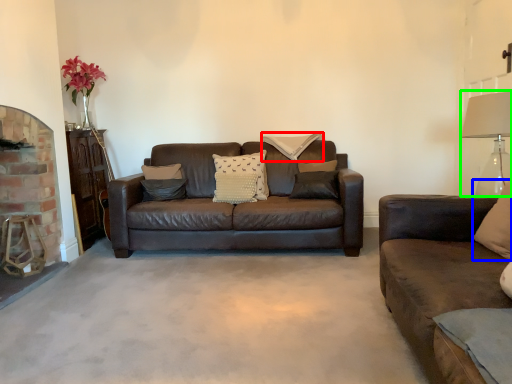
Question: Estimate the real-world distances between objects in this image. Which object is farther from pillow (highlighted by a red box), pillow (highlighted by a blue box) or table lamp (highlighted by a green box)?

Choices:
 (A) pillow
 (B) table lamp

Answer: (A)